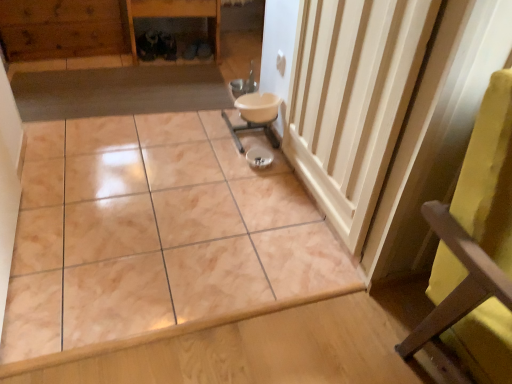
In order to click on vacant area on top of marble tile at center (from a real-world perspective) in this screenshot , I will do `click(150, 131)`.